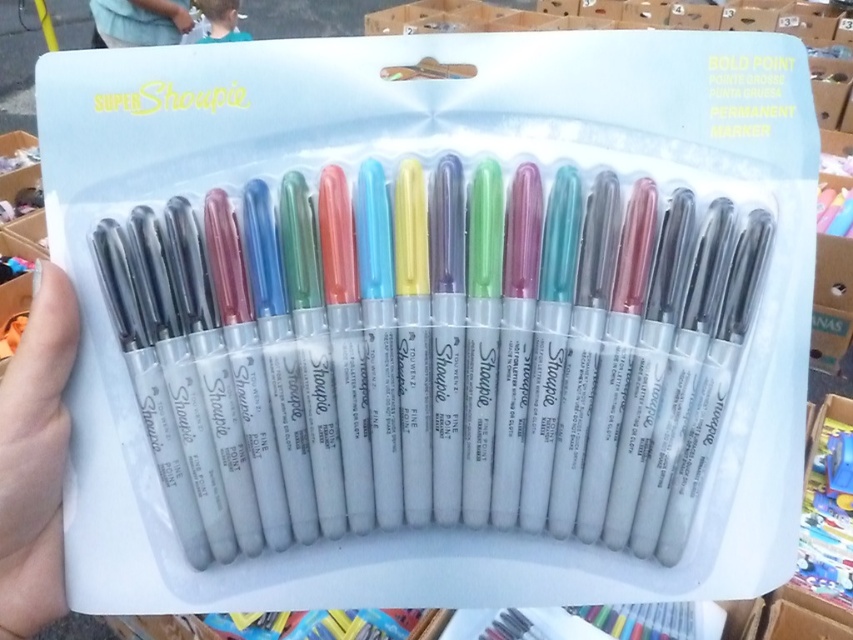
Is translucent plastic markers at center above white matte hand at lower left?

Yes.

Can you confirm if translucent plastic markers at center is positioned to the left of white matte hand at lower left?

In fact, translucent plastic markers at center is to the right of white matte hand at lower left.

Which is in front, point (225, 285) or point (56, 301)?

Point (56, 301) is in front.

This screenshot has width=853, height=640. I want to click on translucent plastic markers at center, so 432,353.

Which is behind, point (128, 16) or point (230, 12)?

The point (230, 12) is behind.

Is the position of blue fabric at upper left less distant than that of blue fabric shirt at upper center?

Yes, it is.

Which is in front, point (114, 44) or point (223, 8)?

Positioned in front is point (114, 44).

Locate an element on the screen. The height and width of the screenshot is (640, 853). blue fabric at upper left is located at coordinates (138, 20).

Is translucent plastic markers at center to the right of blue fabric shirt at upper center from the viewer's perspective?

Indeed, translucent plastic markers at center is positioned on the right side of blue fabric shirt at upper center.

Does translucent plastic markers at center have a lesser width compared to blue fabric shirt at upper center?

In fact, translucent plastic markers at center might be wider than blue fabric shirt at upper center.

What do you see at coordinates (432, 353) in the screenshot? Image resolution: width=853 pixels, height=640 pixels. I see `translucent plastic markers at center` at bounding box center [432, 353].

Where is `translucent plastic markers at center`? translucent plastic markers at center is located at coordinates (432, 353).